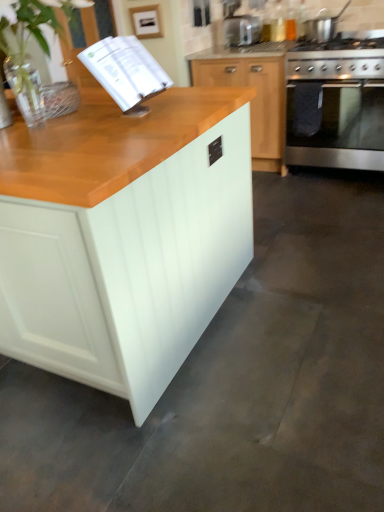
The height and width of the screenshot is (512, 384). I want to click on light wood cabinetry at center, which is the second cabinetry in left-to-right order, so click(254, 101).

The height and width of the screenshot is (512, 384). What do you see at coordinates (323, 25) in the screenshot?
I see `stainless steel pot at upper right` at bounding box center [323, 25].

This screenshot has height=512, width=384. I want to click on stainless steel gas stove at upper right, so click(336, 60).

This screenshot has width=384, height=512. What are the coordinates of `white paper book at upper left` in the screenshot? It's located at (125, 70).

Measure the distance between stainless steel oven at right and camera.

The depth of stainless steel oven at right is 9.06 feet.

This screenshot has height=512, width=384. What do you see at coordinates (242, 30) in the screenshot?
I see `satin silver toaster at upper center` at bounding box center [242, 30].

Where is `light wood cabinetry at center, placed as the first cabinetry when sorted from right to left`? This screenshot has height=512, width=384. light wood cabinetry at center, placed as the first cabinetry when sorted from right to left is located at coordinates (254, 101).

How far apart are stainless steel pot at upper right and satin silver toaster at upper center?

stainless steel pot at upper right is 19.60 inches away from satin silver toaster at upper center.

The height and width of the screenshot is (512, 384). Find the location of `appliance on the left of stainless steel pot at upper right`. appliance on the left of stainless steel pot at upper right is located at coordinates (242, 30).

Does stainless steel pot at upper right have a lesser width compared to satin silver toaster at upper center?

Yes.

Considering the sizes of stainless steel pot at upper right and satin silver toaster at upper center in the image, is stainless steel pot at upper right bigger or smaller than satin silver toaster at upper center?

In the image, stainless steel pot at upper right appears to be larger than satin silver toaster at upper center.

Is stainless steel pot at upper right a part of stainless steel gas stove at upper right?

That's incorrect, stainless steel pot at upper right is not inside stainless steel gas stove at upper right.

In terms of height, does stainless steel gas stove at upper right look taller or shorter compared to stainless steel pot at upper right?

Considering their sizes, stainless steel gas stove at upper right has less height than stainless steel pot at upper right.

Considering the relative sizes of stainless steel gas stove at upper right and stainless steel pot at upper right in the image provided, is stainless steel gas stove at upper right bigger than stainless steel pot at upper right?

Indeed, stainless steel gas stove at upper right has a larger size compared to stainless steel pot at upper right.

In terms of width, does stainless steel gas stove at upper right look wider or thinner when compared to stainless steel pot at upper right?

In the image, stainless steel gas stove at upper right appears to be wider than stainless steel pot at upper right.

Considering the points (13, 1) and (317, 25), which point is behind, point (13, 1) or point (317, 25)?

Point (317, 25)

How distant is green leafy plant at upper left from stainless steel pot at upper right?

A distance of 6.38 feet exists between green leafy plant at upper left and stainless steel pot at upper right.

From the picture: Between green leafy plant at upper left and stainless steel pot at upper right, which one has larger size?

With larger size is green leafy plant at upper left.

From a real-world perspective, is white paper book at upper left positioned above or below white matte cabinet at center, the 1th cabinetry from the front?

white paper book at upper left is above white matte cabinet at center, the 1th cabinetry from the front.

Is the depth of white paper book at upper left greater than that of white matte cabinet at center, the 1th cabinetry from the front?

That is True.

Does white paper book at upper left have a larger size compared to white matte cabinet at center, the 1th cabinetry when ordered from left to right?

Actually, white paper book at upper left might be smaller than white matte cabinet at center, the 1th cabinetry when ordered from left to right.

Between white paper book at upper left and white matte cabinet at center, arranged as the 2th cabinetry when viewed from the back, which one has more height?

white matte cabinet at center, arranged as the 2th cabinetry when viewed from the back, is taller.

This screenshot has width=384, height=512. Find the location of `appliance located on the right of green leafy plant at upper left`. appliance located on the right of green leafy plant at upper left is located at coordinates (242, 30).

How different are the orientations of satin silver toaster at upper center and green leafy plant at upper left in degrees?

The facing directions of satin silver toaster at upper center and green leafy plant at upper left are 179 degrees apart.

From the image's perspective, is satin silver toaster at upper center on green leafy plant at upper left?

Yes, from the image's perspective, satin silver toaster at upper center is over green leafy plant at upper left.

Is satin silver toaster at upper center wider or thinner than green leafy plant at upper left?

Considering their sizes, satin silver toaster at upper center looks slimmer than green leafy plant at upper left.

Consider the image. Can you tell me how much satin silver toaster at upper center and stainless steel gas stove at upper right differ in facing direction?

satin silver toaster at upper center and stainless steel gas stove at upper right are facing 2.63 degrees away from each other.

In the scene shown: Looking at their sizes, would you say satin silver toaster at upper center is wider or thinner than stainless steel gas stove at upper right?

Clearly, satin silver toaster at upper center has less width compared to stainless steel gas stove at upper right.

Is satin silver toaster at upper center to the right of stainless steel gas stove at upper right from the viewer's perspective?

No, satin silver toaster at upper center is not to the right of stainless steel gas stove at upper right.

Between satin silver toaster at upper center and stainless steel gas stove at upper right, which one has less height?

satin silver toaster at upper center is shorter.

From the picture: Between satin silver toaster at upper center and light wood cabinetry at center, which is the second cabinetry in left-to-right order, which one has less height?

satin silver toaster at upper center is shorter.

In the scene shown: Which of these two, satin silver toaster at upper center or light wood cabinetry at center, placed as the first cabinetry when sorted from right to left, is smaller?

satin silver toaster at upper center is smaller.

Does point (249, 20) appear closer or farther from the camera than point (280, 57)?

Point (249, 20) is positioned farther from the camera compared to point (280, 57).

From a real-world perspective, is satin silver toaster at upper center below light wood cabinetry at center, which is the 2th cabinetry in front-to-back order?

No, from a real-world perspective, satin silver toaster at upper center is not beneath light wood cabinetry at center, which is the 2th cabinetry in front-to-back order.

You are a GUI agent. You are given a task and a screenshot of the screen. Output one action in this format:
    pyautogui.click(x=<x>, y=<y>)
    Task: Click on the kitchen appliance on the right of satin silver toaster at upper center
    
    Given the screenshot: What is the action you would take?
    pyautogui.click(x=323, y=25)

The height and width of the screenshot is (512, 384). Identify the location of kitchen appliance that appears behind the stainless steel gas stove at upper right. (323, 25).

Based on their spatial positions, is green leafy plant at upper left or stainless steel pot at upper right closer to white matte cabinet at center, arranged as the 2th cabinetry when viewed from the back?

green leafy plant at upper left is positioned closer to the anchor white matte cabinet at center, arranged as the 2th cabinetry when viewed from the back.

Which object lies nearer to the anchor point white matte cabinet at center, placed as the 2th cabinetry when sorted from right to left, white paper book at upper left or green leafy plant at upper left?

Among the two, white paper book at upper left is located nearer to white matte cabinet at center, placed as the 2th cabinetry when sorted from right to left.

When comparing their distances from white paper book at upper left, does light wood cabinetry at center, which is the second cabinetry in left-to-right order, or green leafy plant at upper left seem closer?

green leafy plant at upper left lies closer to white paper book at upper left than the other object.

Estimate the real-world distances between objects in this image. Which object is further from white paper book at upper left, stainless steel pot at upper right or stainless steel gas stove at upper right?

stainless steel pot at upper right is further to white paper book at upper left.

Estimate the real-world distances between objects in this image. Which object is further from satin silver toaster at upper center, stainless steel pot at upper right or light wood cabinetry at center, placed as the first cabinetry when sorted from right to left?

The object further to satin silver toaster at upper center is light wood cabinetry at center, placed as the first cabinetry when sorted from right to left.

Based on their spatial positions, is stainless steel pot at upper right or green leafy plant at upper left further from stainless steel gas stove at upper right?

green leafy plant at upper left is positioned further to the anchor stainless steel gas stove at upper right.

From the image, which object appears to be farther from stainless steel pot at upper right, white matte cabinet at center, the 1th cabinetry when ordered from left to right, or white paper book at upper left?

white matte cabinet at center, the 1th cabinetry when ordered from left to right, is positioned further to the anchor stainless steel pot at upper right.

Based on their spatial positions, is light wood cabinetry at center, placed as the first cabinetry when sorted from right to left, or satin silver toaster at upper center further from stainless steel oven at right?

satin silver toaster at upper center is positioned further to the anchor stainless steel oven at right.

Identify the location of kitchen appliance between satin silver toaster at upper center and stainless steel oven at right in the up-down direction. The width and height of the screenshot is (384, 512). (323, 25).

The height and width of the screenshot is (512, 384). I want to click on gas stove located between green leafy plant at upper left and light wood cabinetry at center, which is the second cabinetry in left-to-right order, in the depth direction, so click(x=336, y=60).

Where is `book between white matte cabinet at center, the 1th cabinetry when ordered from left to right, and satin silver toaster at upper center from front to back`? The width and height of the screenshot is (384, 512). book between white matte cabinet at center, the 1th cabinetry when ordered from left to right, and satin silver toaster at upper center from front to back is located at coordinates (125, 70).

Where is `book between green leafy plant at upper left and stainless steel gas stove at upper right in the horizontal direction`? The height and width of the screenshot is (512, 384). book between green leafy plant at upper left and stainless steel gas stove at upper right in the horizontal direction is located at coordinates (125, 70).